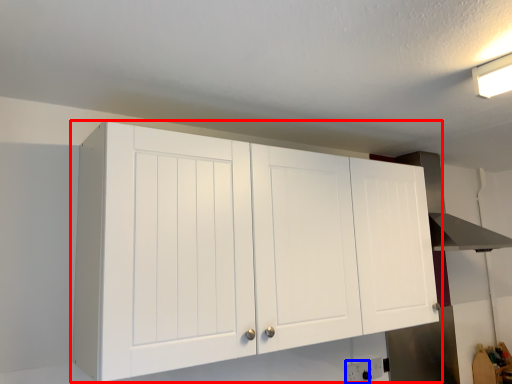
Question: Which object is closer to the camera taking this photo, cupboard (highlighted by a red box) or electric outlet (highlighted by a blue box)?

Choices:
 (A) cupboard
 (B) electric outlet

Answer: (A)